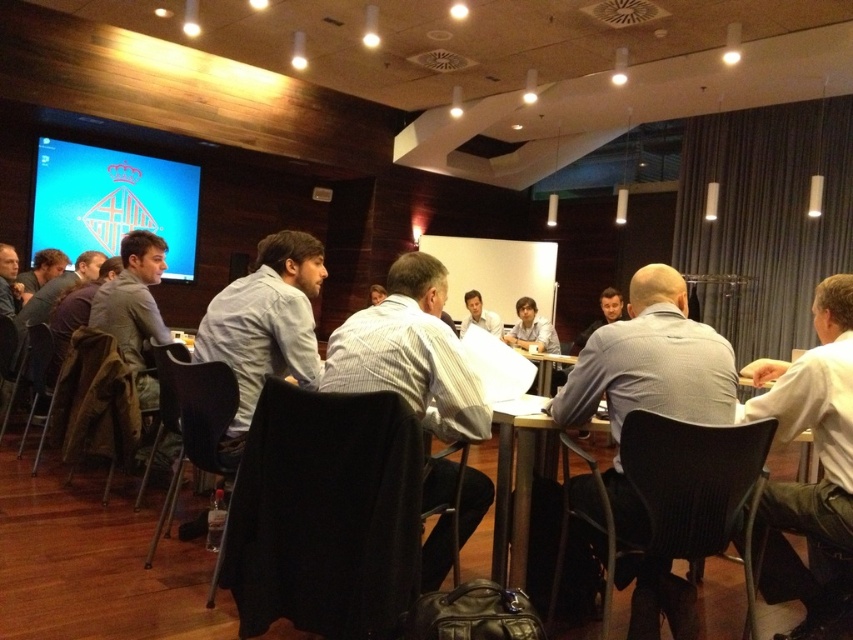
Question: Is white striped shirt at center to the right of matte plastic screen at upper left from the viewer's perspective?

Choices:
 (A) no
 (B) yes

Answer: (B)

Question: Which of the following is the farthest from the observer?

Choices:
 (A) (158, 340)
 (B) (496, 333)
 (C) (564, 356)
 (D) (666, 586)

Answer: (B)

Question: Can you confirm if white striped shirt at center is positioned to the right of matte plastic screen at upper left?

Choices:
 (A) yes
 (B) no

Answer: (A)

Question: Among these points, which one is farthest from the camera?

Choices:
 (A) (149, 330)
 (B) (666, 598)

Answer: (A)

Question: Among these objects, which one is farthest from the camera?

Choices:
 (A) matte plastic screen at upper left
 (B) white shirt at right
 (C) matte white shirt at center

Answer: (A)

Question: Does gray fabric shirt at center lie behind matte plastic screen at upper left?

Choices:
 (A) no
 (B) yes

Answer: (A)